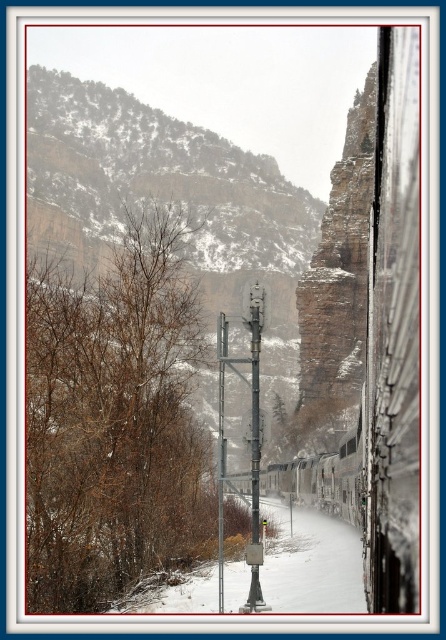
Is brown/drytree at left wider than metallic gray pole at center?

Yes.

Which is more to the right, brown/drytree at left or metallic gray pole at center?

Positioned to the right is metallic gray pole at center.

Is point (174, 296) farther from camera compared to point (252, 572)?

Yes, point (174, 296) is farther from viewer.

Where is `brown/drytree at left`? This screenshot has height=640, width=446. brown/drytree at left is located at coordinates (115, 420).

In the scene shown: Can you confirm if metal train at right is positioned above brown/drytree at left?

Yes.

Does metal train at right appear under brown/drytree at left?

Incorrect, metal train at right is not positioned below brown/drytree at left.

Who is more distant from viewer, [111,426] or [99,516]?

Point [111,426]

I want to click on metal train at right, so click(x=188, y=292).

Is point (164, 256) less distant than point (261, 595)?

No, it is behind (261, 595).

This screenshot has width=446, height=640. I want to click on metal train at right, so click(x=188, y=292).